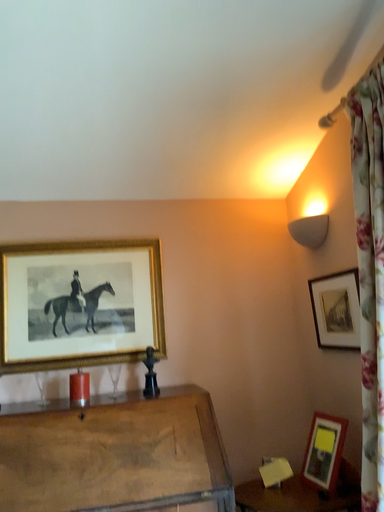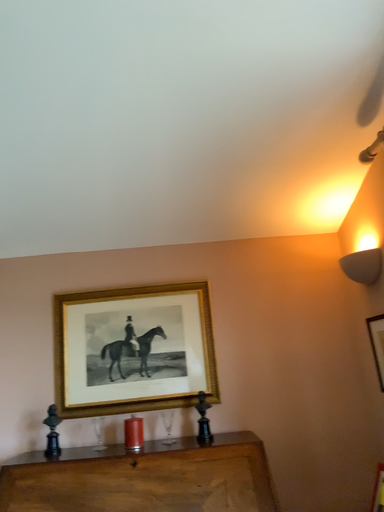
Question: Which way did the camera rotate in the video?

Choices:
 (A) rotated right
 (B) rotated left

Answer: (B)